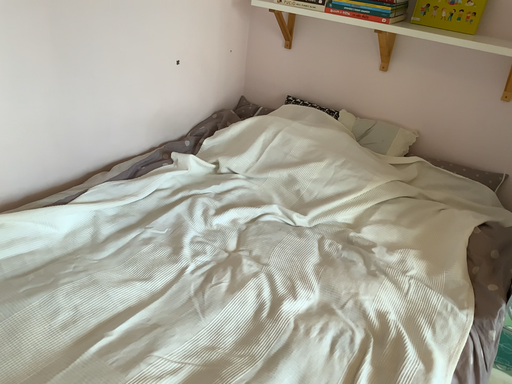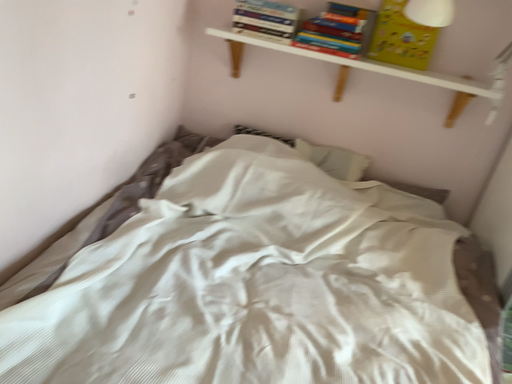
Question: How did the camera likely rotate when shooting the video?

Choices:
 (A) rotated left
 (B) rotated right

Answer: (B)